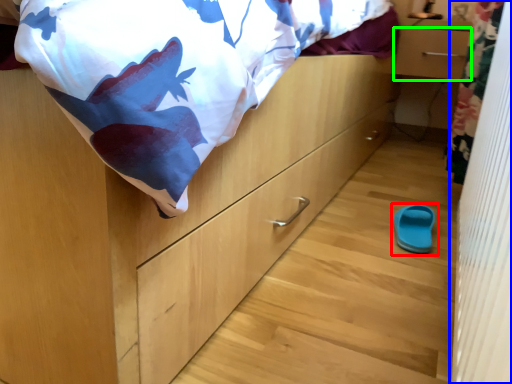
Question: Which object is positioned farthest from footwear (highlighted by a red box)? Select from curtain (highlighted by a blue box) and drawer (highlighted by a green box).

Choices:
 (A) curtain
 (B) drawer

Answer: (B)